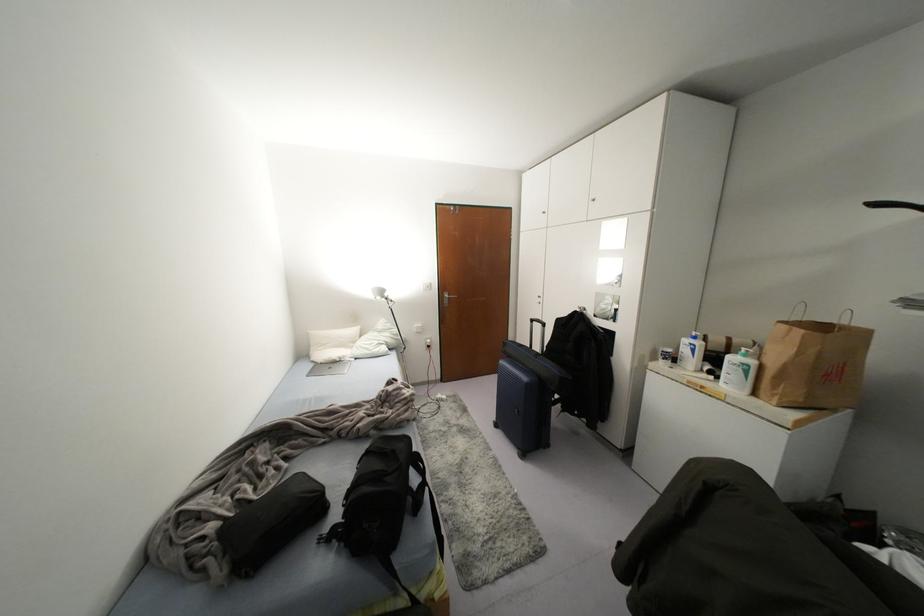
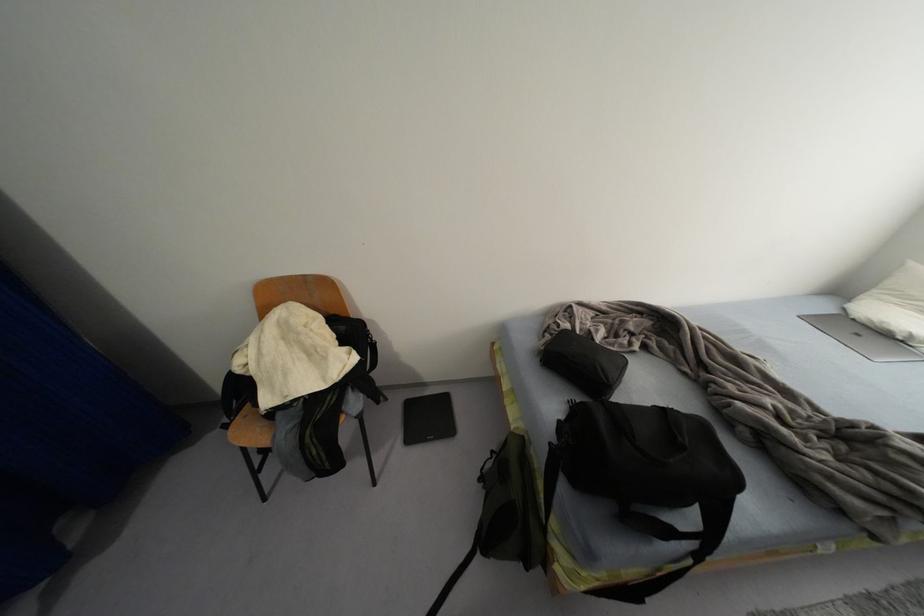
How did the camera likely rotate?

The camera rotated toward left-down.